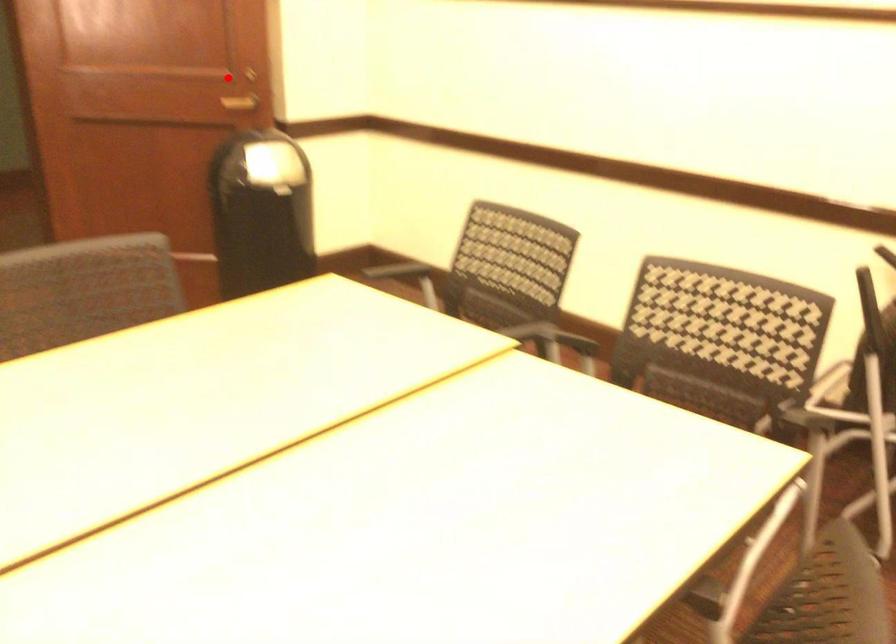
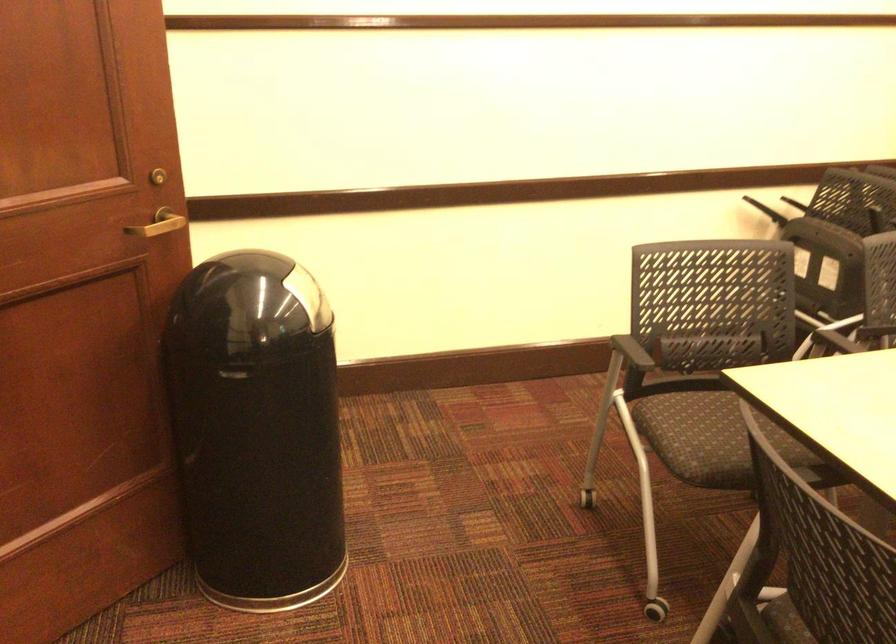
Question: I am providing you with two images of the same scene from different viewpoints. In image1, a red point is highlighted. Considering the same 3D point in image2, which of the following is correct?

Choices:
 (A) It is closer
 (B) It is farther

Answer: (A)